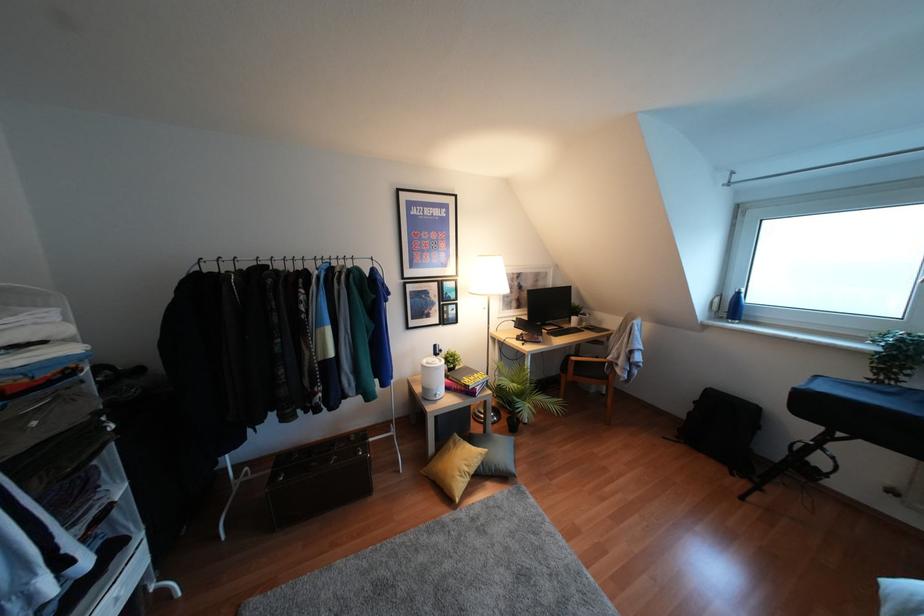
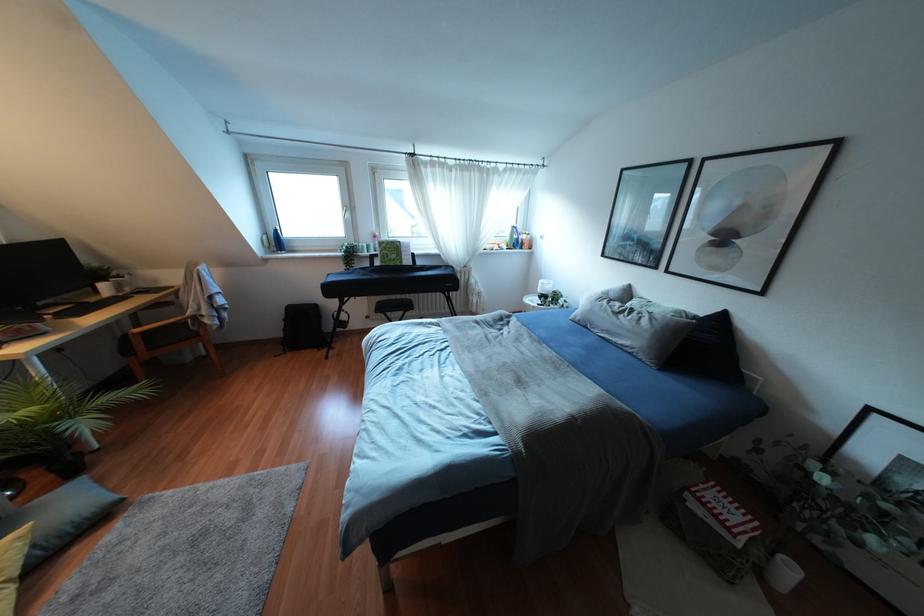
Locate, in the second image, the point that corresponds to (688,413) in the first image.

(284, 329)